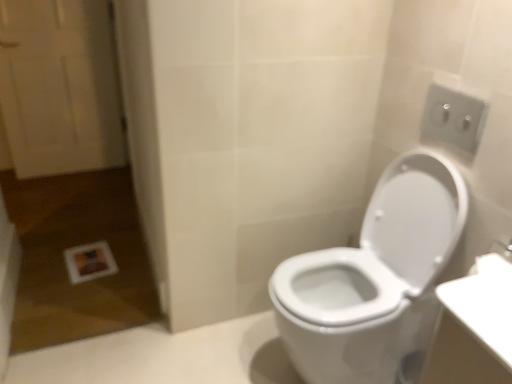
The height and width of the screenshot is (384, 512). I want to click on white wooden door at left, so click(59, 86).

Where is `white plastic outlet at upper right`? The height and width of the screenshot is (384, 512). white plastic outlet at upper right is located at coordinates (453, 118).

Locate an element on the screen. The image size is (512, 384). white glossy toilet at right is located at coordinates (373, 278).

From a real-world perspective, between white glossy toilet at right and white plastic outlet at upper right, who is vertically lower?

white glossy toilet at right is physically lower.

From the picture: Is white glossy toilet at right bigger than white plastic outlet at upper right?

Yes, white glossy toilet at right is bigger than white plastic outlet at upper right.

Between white glossy toilet at right and white plastic outlet at upper right, which one has larger width?

With larger width is white glossy toilet at right.

Is white plastic outlet at upper right at the back of white glossy toilet at right?

No, white glossy toilet at right's orientation is not away from white plastic outlet at upper right.

You are a GUI agent. You are given a task and a screenshot of the screen. Output one action in this format:
    pyautogui.click(x=<x>, y=<y>)
    Task: Click on the screen door located above the white plastic outlet at upper right (from the image's perspective)
    
    Given the screenshot: What is the action you would take?
    pyautogui.click(x=59, y=86)

Considering the relative sizes of white plastic outlet at upper right and white wooden door at left in the image provided, is white plastic outlet at upper right shorter than white wooden door at left?

Correct, white plastic outlet at upper right is not as tall as white wooden door at left.

Do you think white plastic outlet at upper right is within white wooden door at left, or outside of it?

white plastic outlet at upper right is spatially situated outside white wooden door at left.

In the scene shown: Would you consider white plastic outlet at upper right to be distant from white wooden door at left?

Yes.

Is white wooden door at left positioned with its back to white glossy toilet at right?

No, white wooden door at left is not facing away from white glossy toilet at right.

From the image's perspective, relative to white glossy toilet at right, is white wooden door at left above or below?

white wooden door at left is above white glossy toilet at right.

Who is taller, white wooden door at left or white glossy toilet at right?

white wooden door at left is taller.

Which object is further away from the camera, white wooden door at left or white glossy toilet at right?

white wooden door at left is further away from the camera.

Is white wooden door at left oriented towards white plastic outlet at upper right?

Yes, white wooden door at left is turned towards white plastic outlet at upper right.

In order to click on electric outlet on the right of white wooden door at left in this screenshot , I will do `click(453, 118)`.

From the picture: Is white wooden door at left not close to white plastic outlet at upper right?

Yes, white wooden door at left and white plastic outlet at upper right are located far from each other.

Considering the sizes of white wooden door at left and white plastic outlet at upper right in the image, is white wooden door at left taller or shorter than white plastic outlet at upper right?

Considering their sizes, white wooden door at left has more height than white plastic outlet at upper right.

Identify the location of toilet directly beneath the white wooden door at left (from a real-world perspective). The width and height of the screenshot is (512, 384). (373, 278).

Considering the relative positions of white glossy toilet at right and white wooden door at left in the image provided, is white glossy toilet at right in front of white wooden door at left?

Yes, it is in front of white wooden door at left.

Is point (351, 301) behind point (38, 33)?

No, (351, 301) is in front of (38, 33).

Looking at this image, which is more to the right, white glossy toilet at right or white wooden door at left?

white glossy toilet at right is more to the right.

Considering the relative sizes of white plastic outlet at upper right and white glossy toilet at right in the image provided, is white plastic outlet at upper right bigger than white glossy toilet at right?

Actually, white plastic outlet at upper right might be smaller than white glossy toilet at right.

Is white plastic outlet at upper right far from white glossy toilet at right?

No, white plastic outlet at upper right is not far from white glossy toilet at right.

Is white plastic outlet at upper right located outside white glossy toilet at right?

white plastic outlet at upper right lies outside white glossy toilet at right's area.

Is white plastic outlet at upper right facing towards white glossy toilet at right?

No.

Image resolution: width=512 pixels, height=384 pixels. In order to click on toilet below the white plastic outlet at upper right (from a real-world perspective) in this screenshot , I will do `click(373, 278)`.

This screenshot has height=384, width=512. Find the location of `electric outlet located above the white wooden door at left (from a real-world perspective)`. electric outlet located above the white wooden door at left (from a real-world perspective) is located at coordinates (453, 118).

Based on the photo, when comparing their distances from white plastic outlet at upper right, does white wooden door at left or white glossy toilet at right seem further?

Based on the image, white wooden door at left appears to be further to white plastic outlet at upper right.

Estimate the real-world distances between objects in this image. Which object is closer to white glossy toilet at right, white plastic outlet at upper right or white wooden door at left?

white plastic outlet at upper right is positioned closer to the anchor white glossy toilet at right.

Estimate the real-world distances between objects in this image. Which object is closer to white plastic outlet at upper right, white glossy toilet at right or white wooden door at left?

white glossy toilet at right is positioned closer to the anchor white plastic outlet at upper right.

Looking at the image, which one is located further to white wooden door at left, white glossy toilet at right or white plastic outlet at upper right?

Based on the image, white plastic outlet at upper right appears to be further to white wooden door at left.

Considering their positions, is white plastic outlet at upper right positioned further to white wooden door at left than white glossy toilet at right?

The object further to white wooden door at left is white plastic outlet at upper right.

Based on their spatial positions, is white wooden door at left or white plastic outlet at upper right further from white glossy toilet at right?

Based on the image, white wooden door at left appears to be further to white glossy toilet at right.

This screenshot has width=512, height=384. I want to click on toilet between white wooden door at left and white plastic outlet at upper right, so click(373, 278).